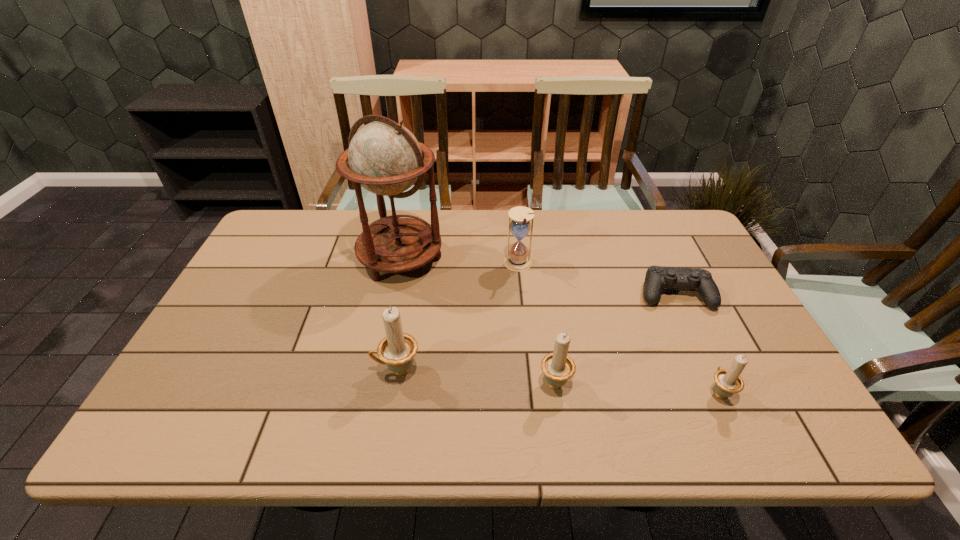
Locate an element on the screen. The height and width of the screenshot is (540, 960). empty location between the rightmost candle_holder and the hourglass is located at coordinates (618, 328).

I want to click on vacant space that is in between the shortest candle_holder and the globe, so click(560, 325).

The image size is (960, 540). Identify the location of vacant area between the shortest object and the leftmost candle_holder. (536, 332).

The height and width of the screenshot is (540, 960). I want to click on vacant area between the second candle_holder from right to left and the fifth tallest object, so click(x=636, y=387).

This screenshot has width=960, height=540. What are the coordinates of `free spot between the leftmost candle_holder and the shortest object` in the screenshot? It's located at (536, 332).

Locate an element on the screen. The height and width of the screenshot is (540, 960). unoccupied position between the globe and the shortest object is located at coordinates (538, 276).

The width and height of the screenshot is (960, 540). I want to click on free space between the control and the second shortest object, so click(697, 343).

Identify which object is located as the second nearest to the second shortest candle_holder. Please provide its 2D coordinates. Your answer should be formatted as a tuple, i.e. [(x, y)], where the tuple contains the x and y coordinates of a point satisfying the conditions above.

[(657, 277)]

Find the location of `object that can be found as the fifth closest to the rightmost candle_holder`. object that can be found as the fifth closest to the rightmost candle_holder is located at coordinates (384, 157).

Identify the location of candle_holder that is the third nearest to the globe. (728, 382).